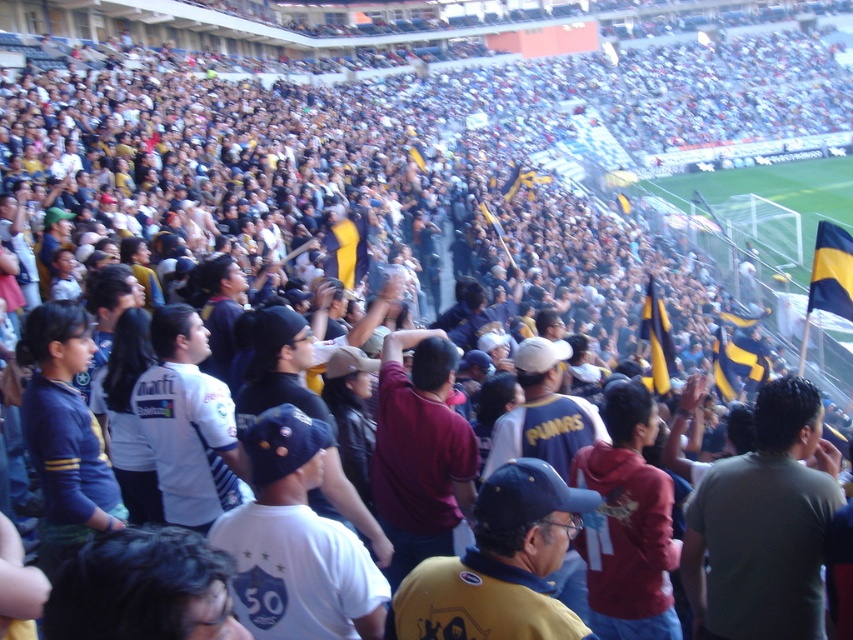
You are standing at the point with coordinates point (657, 339) in the stadium. What object is located at that point?

The point (657, 339) corresponds to the yellowmaterial texture flag at center right.

You are a photographer standing at the edge of the field in the stadium. You want to take a photo that includes both the point at coordinates point (849, 305) and point (346, 218). Which point should you focus on first to ensure both are in focus?

Since point (849, 305) is closer to the camera than point (346, 218), you should focus on point (849, 305) first. This ensures that the closer point is in focus, and the farther point will also be in focus due to the depth of field.